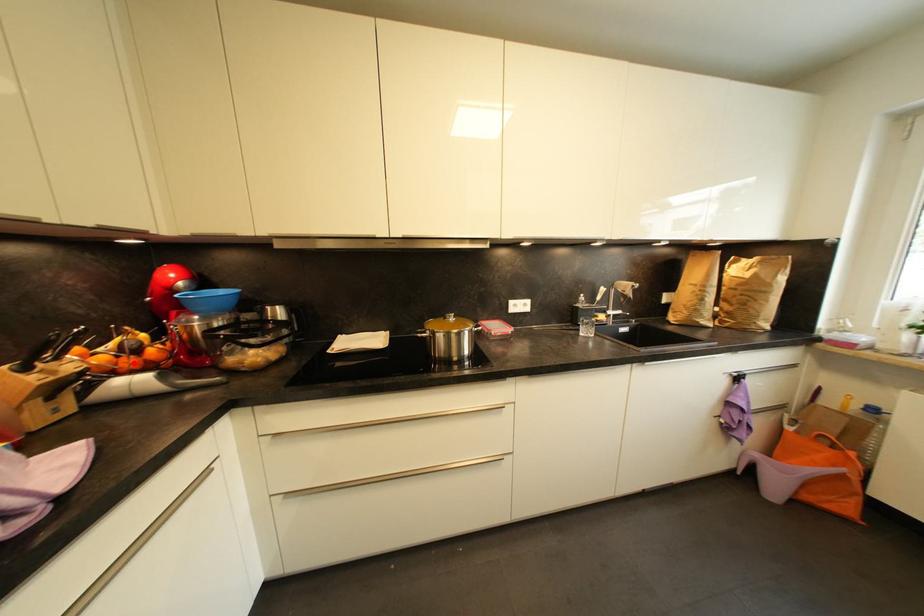
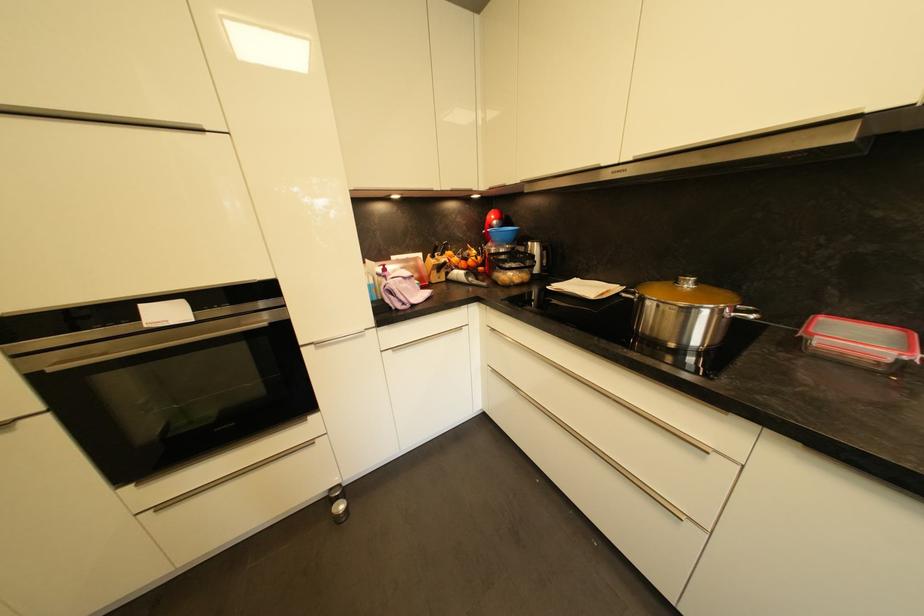
Locate, in the second image, the point that corresponds to the highlighted location in the first image.

(468, 265)